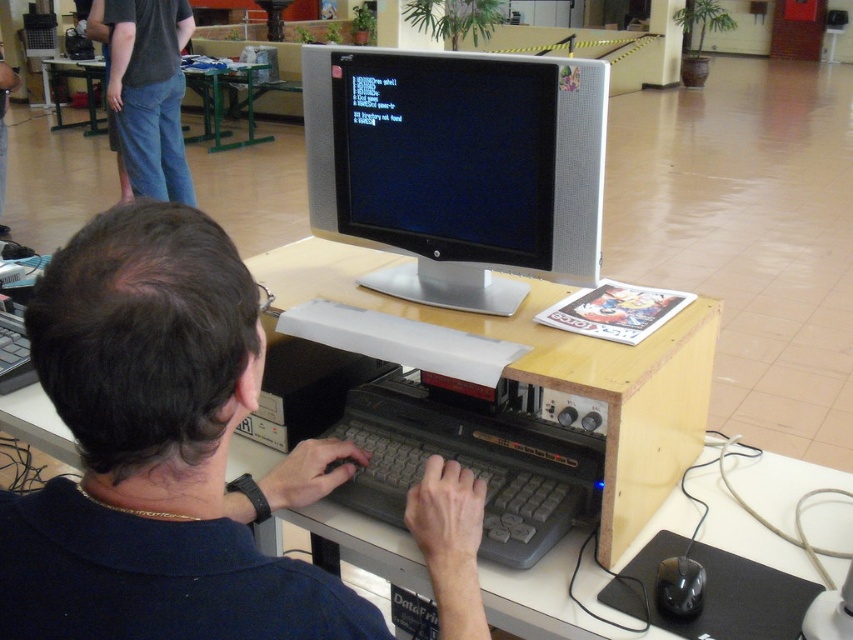
This screenshot has height=640, width=853. What do you see at coordinates (149, 92) in the screenshot?
I see `jeans at left` at bounding box center [149, 92].

How far apart are jeans at left and black plastic mouse at lower right?

13.89 feet

Locate an element on the screen. Image resolution: width=853 pixels, height=640 pixels. jeans at left is located at coordinates (149, 92).

Is silver metallic monitor at center taller than jeans at left?

No, silver metallic monitor at center is not taller than jeans at left.

Is point (384, 125) positioned in front of point (113, 93)?

Yes.

Image resolution: width=853 pixels, height=640 pixels. I want to click on silver metallic monitor at center, so (457, 168).

Is dark blue shirt at center smaller than green metal table at upper left?

Correct, dark blue shirt at center occupies less space than green metal table at upper left.

Which is below, dark blue shirt at center or green metal table at upper left?

dark blue shirt at center is lower down.

Which is in front, point (1, 593) or point (68, 65)?

Point (1, 593)

The image size is (853, 640). Identify the location of dark blue shirt at center. (161, 451).